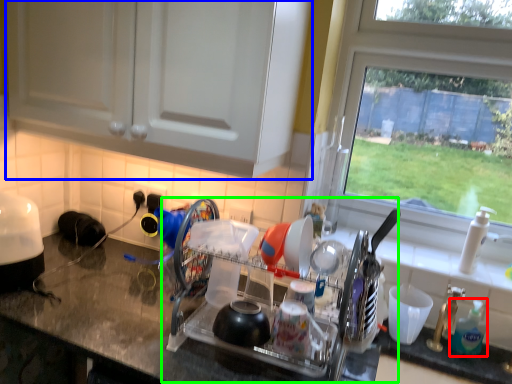
Question: Estimate the real-world distances between objects in this image. Which object is farther from soap dispenser (highlighted by a red box), cabinetry (highlighted by a blue box) or dish washer (highlighted by a green box)?

Choices:
 (A) cabinetry
 (B) dish washer

Answer: (A)